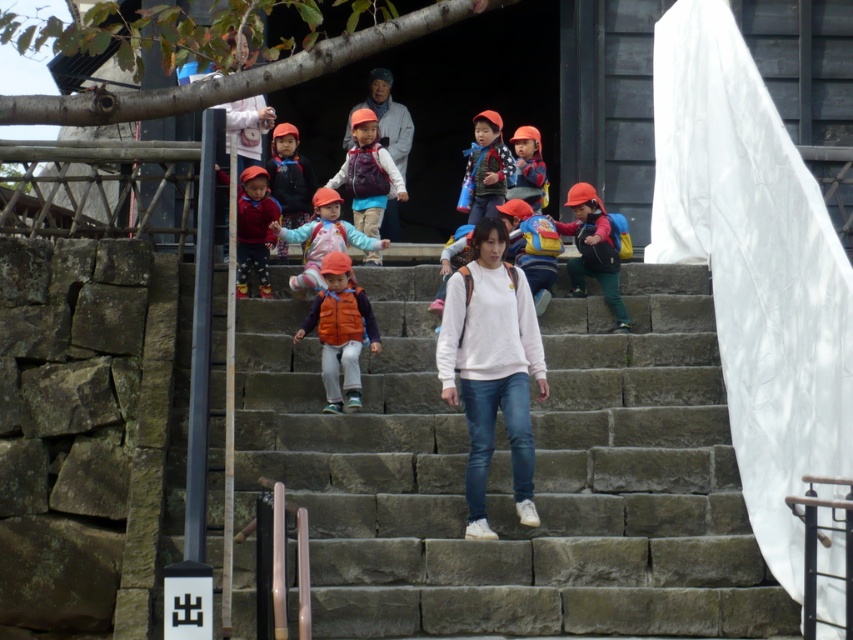
Question: Among these objects, which one is nearest to the camera?

Choices:
 (A) matte orange vest at center
 (B) orange fabric jacket at center

Answer: (B)

Question: Observing the image, what is the correct spatial positioning of orange fabric jacket at center in reference to matte black jacket at center?

Choices:
 (A) above
 (B) below

Answer: (B)

Question: Among these objects, which one is nearest to the camera?

Choices:
 (A) matte orange vest at center
 (B) orange fabric jacket at center
 (C) matte purple backpack at center

Answer: (B)

Question: Where is checkered fabric shirt at center located in relation to matte black jacket at center in the image?

Choices:
 (A) right
 (B) left

Answer: (A)

Question: Can you confirm if stone stairs at center is positioned above matte orange helmet at center?

Choices:
 (A) yes
 (B) no

Answer: (B)

Question: Among these objects, which one is farthest from the camera?

Choices:
 (A) checkered fabric shirt at center
 (B) matte orange helmet at center
 (C) orange fabric jacket at center

Answer: (A)